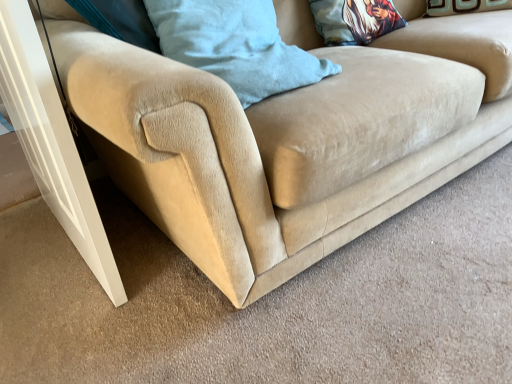
Find the location of a particular element. This screenshot has width=512, height=384. free spot in front of white glossy screen door at lower left is located at coordinates (75, 317).